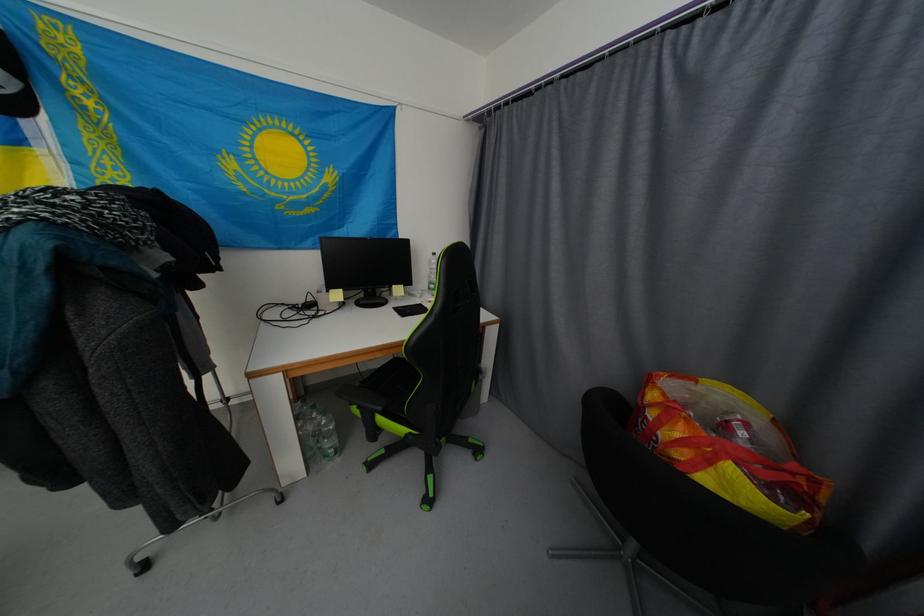
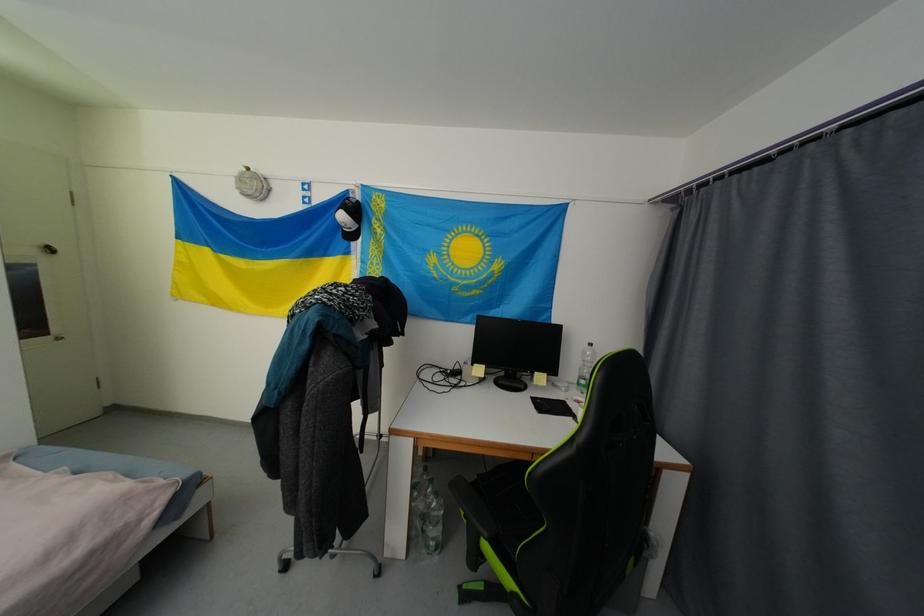
In the second image, find the point that corresponds to pixel 336 293 in the first image.

(480, 367)